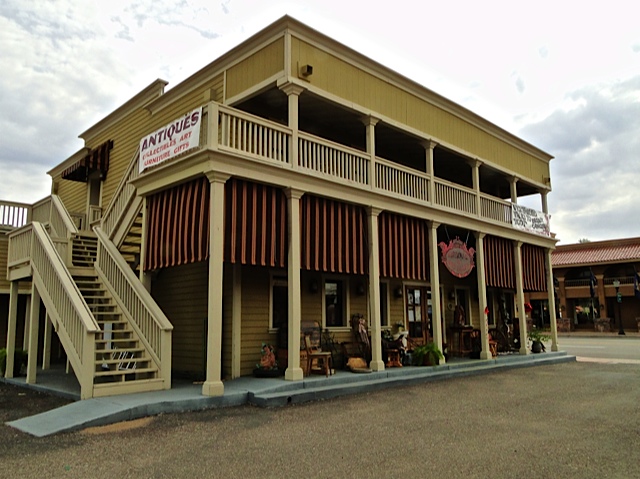
Find the location of `floor`. floor is located at coordinates (294, 433), (575, 348).